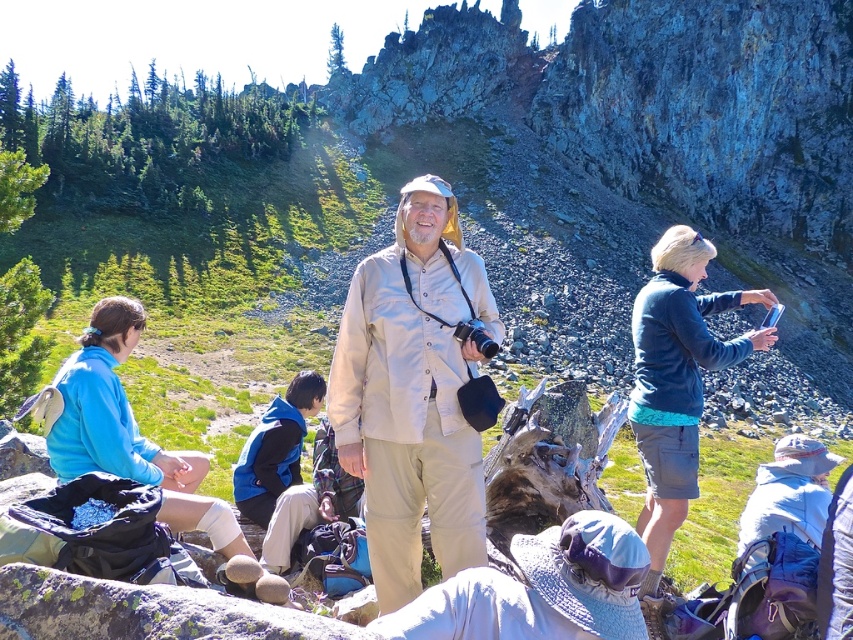
Consider the image. Between beige fabric shirt at center and dark blue fleece at right, which one is positioned lower?

dark blue fleece at right is below.

Can you confirm if beige fabric shirt at center is thinner than dark blue fleece at right?

Yes.

Locate an element on the screen. The height and width of the screenshot is (640, 853). beige fabric shirt at center is located at coordinates click(413, 392).

How far apart are dark blue fleece at right and blue fleece jacket at lower left?

The distance of dark blue fleece at right from blue fleece jacket at lower left is 25.68 meters.

Is dark blue fleece at right positioned at the back of blue fleece jacket at lower left?

No, it is in front of blue fleece jacket at lower left.

Is point (711, 360) positioned behind point (140, 333)?

No, (711, 360) is in front of (140, 333).

Locate an element on the screen. This screenshot has width=853, height=640. dark blue fleece at right is located at coordinates (677, 380).

Does beige fabric shirt at center have a smaller size compared to blue fleece jacket at lower left?

Yes, beige fabric shirt at center is smaller than blue fleece jacket at lower left.

Does point (334, 429) come farther from viewer compared to point (90, 397)?

Yes, point (334, 429) is farther from viewer.

You are a GUI agent. You are given a task and a screenshot of the screen. Output one action in this format:
    pyautogui.click(x=<x>, y=<y>)
    Task: Click on the beige fabric shirt at center
    The height and width of the screenshot is (640, 853).
    Given the screenshot: What is the action you would take?
    pyautogui.click(x=413, y=392)